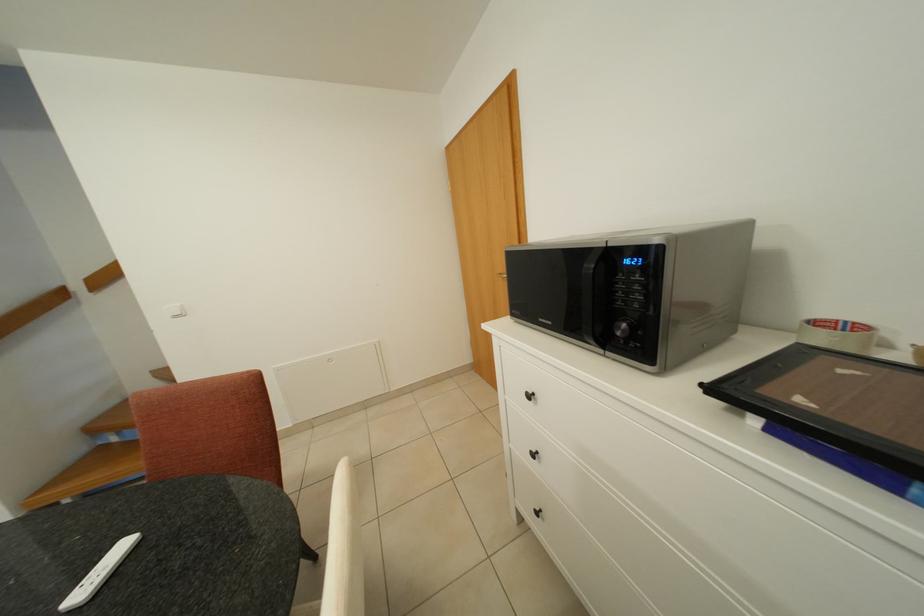
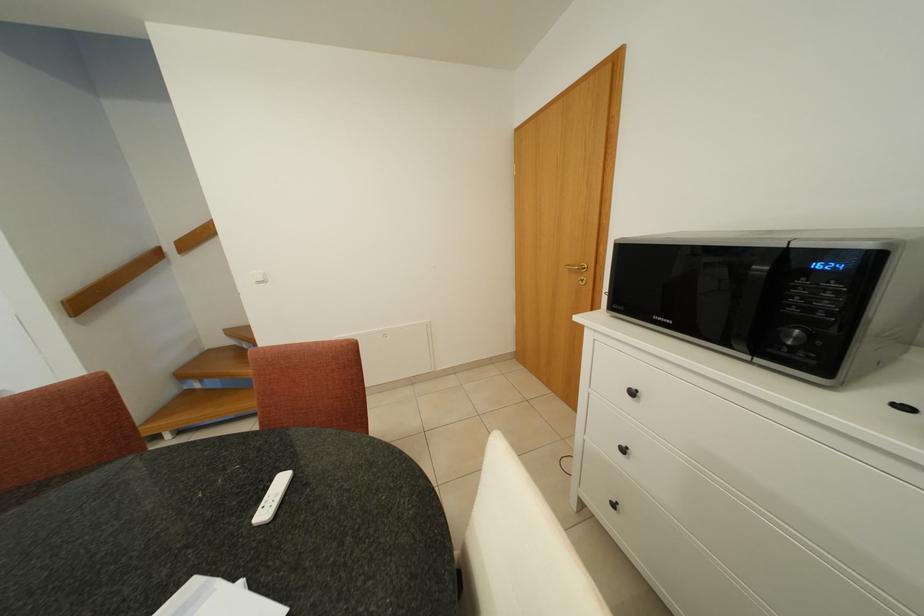
Question: The first image is from the beginning of the video and the second image is from the end. How did the camera likely rotate when shooting the video?

Choices:
 (A) Left
 (B) Right
 (C) Up
 (D) Down

Answer: (A)